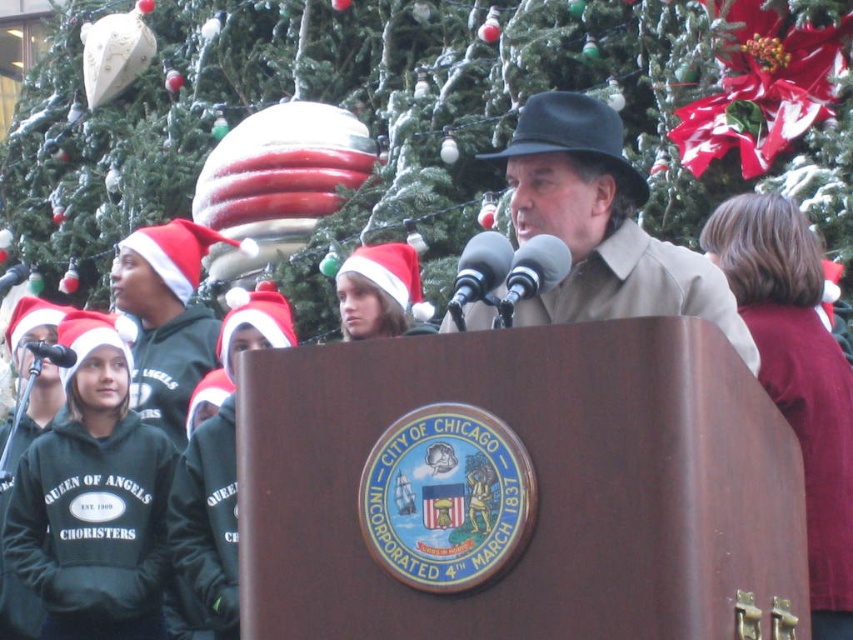
You are attending a holiday event and notice a man in a matte brown coat at center and metallic silver microphones at center. Which object is located to the right of the other?

The matte brown coat at center is positioned on the right side of metallic silver microphones at center.